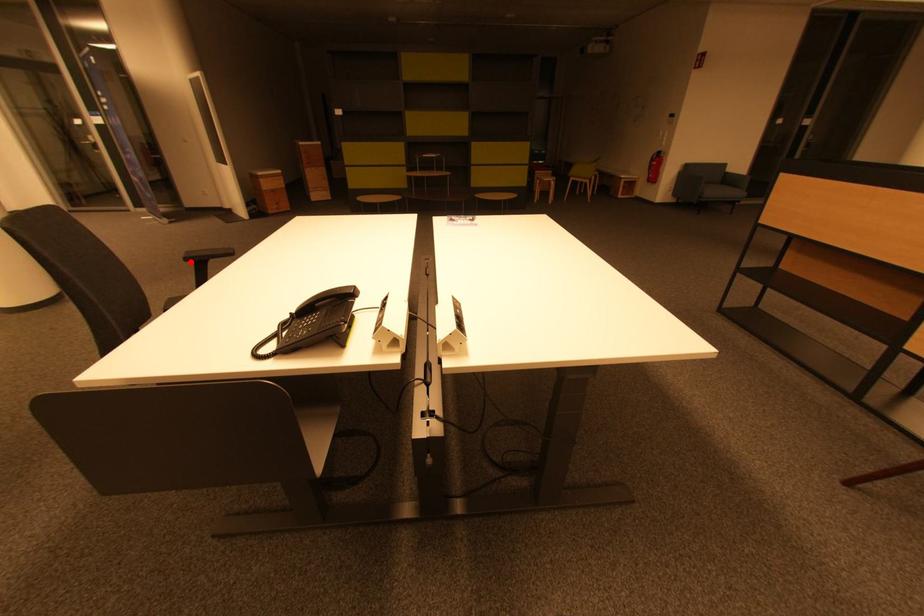
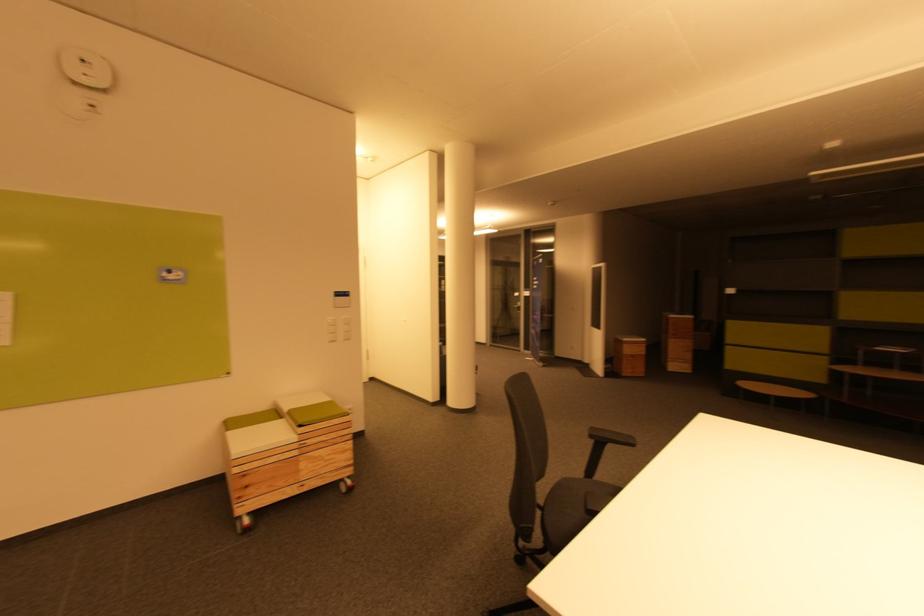
The point at the highlighted location is marked in the first image. Where is the corresponding point in the second image?

(596, 438)